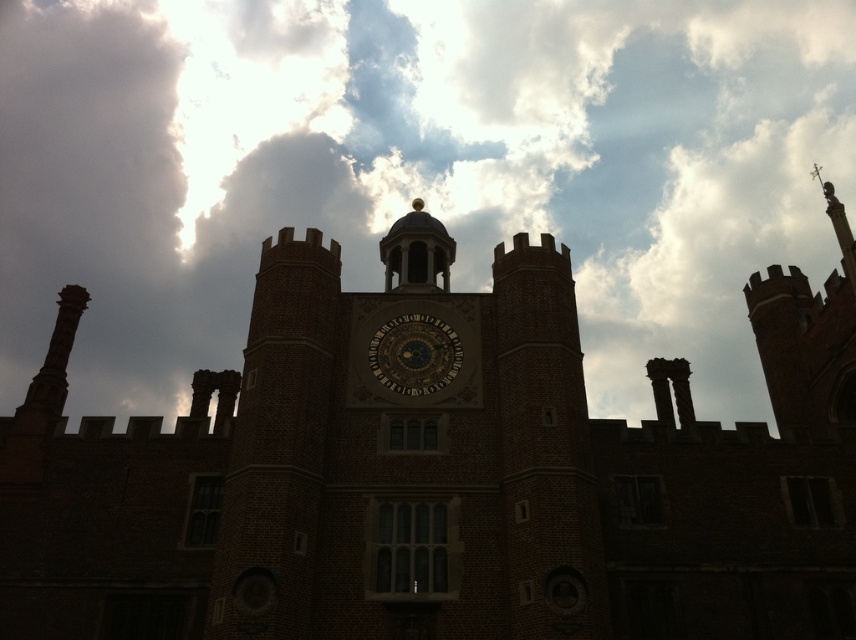
You are standing in front of the grand historic building and want to take a photo of the large clock at the center. To ensure the white fluffy cloud at upper center is visible in the frame, where should you position the cloud relative to the clock?

The white fluffy cloud at upper center is located at point coordinates (412, 168). Since the clock is at the center of the building, positioning the cloud slightly above and to the left of the clock would ensure it appears in the frame.

You are an architect designing a new lighting system for the brick clock tower at center. You need to ensure that the white fluffy cloud at upper center does not cast a shadow over the clock face during sunset. Based on their sizes, can you determine if the cloud is wide enough to block the sunlight?

The white fluffy cloud at upper center might be wider than brick clock tower at center, so there is a possibility that it could cast a shadow over the clock face during sunset if its width exceeds the tower.